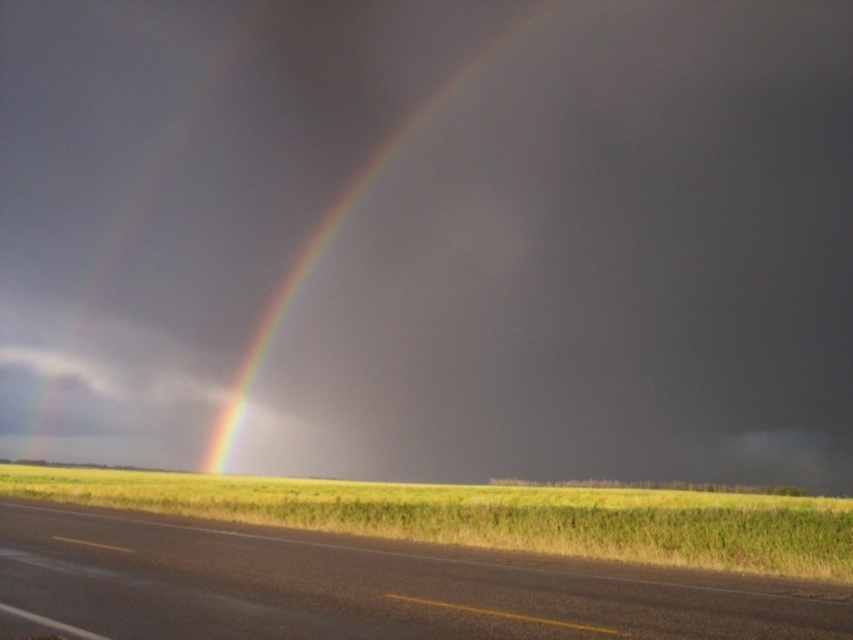
Question: Which point is closer to the camera?

Choices:
 (A) pyautogui.click(x=315, y=547)
 (B) pyautogui.click(x=241, y=412)

Answer: (A)

Question: In this image, where is asphalt road at lower center located relative to glossy rainbow at center?

Choices:
 (A) below
 (B) above

Answer: (A)

Question: Is asphalt road at lower center to the left of glossy rainbow at center from the viewer's perspective?

Choices:
 (A) yes
 (B) no

Answer: (B)

Question: Can you confirm if asphalt road at lower center is bigger than glossy rainbow at center?

Choices:
 (A) no
 (B) yes

Answer: (A)